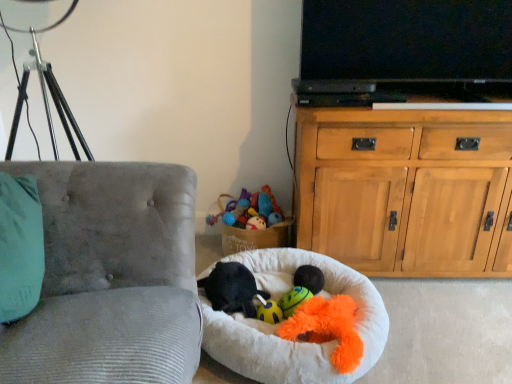
What is the approximate height of white fluffy dog bed at center?

It is 20.51 centimeters.

The width and height of the screenshot is (512, 384). Find the location of `white fluffy dog bed at center`. white fluffy dog bed at center is located at coordinates (276, 326).

Describe the element at coordinates (405, 190) in the screenshot. I see `wooden cabinet at right` at that location.

The image size is (512, 384). Find the location of `wooden cabinet at right`. wooden cabinet at right is located at coordinates (405, 190).

Locate an element on the screen. This screenshot has height=384, width=512. fluffy orange plush toy at center, which is counted as the second toy, starting from the back is located at coordinates (327, 328).

Describe the element at coordinates (110, 277) in the screenshot. Image resolution: width=512 pixels, height=384 pixels. I see `velvet gray chair at left` at that location.

The width and height of the screenshot is (512, 384). Describe the element at coordinates (293, 300) in the screenshot. I see `yellow rubber ball at center, positioned as the 2th toy in front-to-back order` at that location.

Locate an element on the screen. Image resolution: width=512 pixels, height=384 pixels. black plush dog bed at lower center, placed as the second animal when sorted from right to left is located at coordinates (232, 289).

From a real-world perspective, does fluffy orange plush toy at center, which is the first toy in front-to-back order, sit lower than velvet gray chair at left?

Yes.

Is fluffy orange plush toy at center, which is the first toy in front-to-back order, bigger than velvet gray chair at left?

Incorrect, fluffy orange plush toy at center, which is the first toy in front-to-back order, is not larger than velvet gray chair at left.

In the image, is fluffy orange plush toy at center, which is the first toy in front-to-back order, on the left side or the right side of velvet gray chair at left?

→ In the image, fluffy orange plush toy at center, which is the first toy in front-to-back order, appears on the right side of velvet gray chair at left.

Considering the positions of points (335, 333) and (33, 163), is point (335, 333) farther from camera compared to point (33, 163)?

Yes, point (335, 333) is behind point (33, 163).

Between point (223, 270) and point (311, 295), which one is positioned in front?

The point (311, 295) is closer to the camera.

Could yellow rubber ball at center, positioned as the 2th toy in front-to-back order, be considered to be inside black plush dog bed at lower center, which is the first animal in left-to-right order?

No, yellow rubber ball at center, positioned as the 2th toy in front-to-back order, is not surrounded by black plush dog bed at lower center, which is the first animal in left-to-right order.

Does black plush dog bed at lower center, placed as the second animal when sorted from right to left, have a lesser width compared to yellow rubber ball at center, which appears as the first toy when viewed from the back?

No.

From the image's perspective, which object appears higher, black plush dog bed at lower center, placed as the second animal when sorted from right to left, or yellow rubber ball at center, positioned as the 2th toy in front-to-back order?

black plush dog bed at lower center, placed as the second animal when sorted from right to left.

Does wooden cabinet at right have a greater height compared to black plush dog bed at lower center, which is the first animal in left-to-right order?

Correct, wooden cabinet at right is much taller as black plush dog bed at lower center, which is the first animal in left-to-right order.

From the image's perspective, is wooden cabinet at right below black plush dog bed at lower center, placed as the second animal when sorted from right to left?

Incorrect, from the image's perspective, wooden cabinet at right is higher than black plush dog bed at lower center, placed as the second animal when sorted from right to left.

Which object is further away from the camera taking this photo, yellow rubber ball at center, which appears as the first toy when viewed from the back, or wooden cabinet at right?

wooden cabinet at right is further away from the camera.

Is yellow rubber ball at center, positioned as the 2th toy in front-to-back order, positioned far away from wooden cabinet at right?

No.

Is yellow rubber ball at center, positioned as the 2th toy in front-to-back order, surrounding wooden cabinet at right?

No, wooden cabinet at right is not a part of yellow rubber ball at center, positioned as the 2th toy in front-to-back order.

From the picture: From the image's perspective, does yellow rubber ball at center, positioned as the 2th toy in front-to-back order, appear higher than wooden cabinet at right?

No, from the image's perspective, yellow rubber ball at center, positioned as the 2th toy in front-to-back order, is not on top of wooden cabinet at right.

Is black plush toy at center, which is counted as the 1th animal, starting from the right, inside velvet gray chair at left?

Actually, black plush toy at center, which is counted as the 1th animal, starting from the right, is outside velvet gray chair at left.

Based on their sizes in the image, would you say velvet gray chair at left is bigger or smaller than black plush toy at center, which is counted as the 1th animal, starting from the right?

velvet gray chair at left is bigger than black plush toy at center, which is counted as the 1th animal, starting from the right.

Is velvet gray chair at left facing away from black plush toy at center, which is counted as the 1th animal, starting from the right?

velvet gray chair at left does not have its back to black plush toy at center, which is counted as the 1th animal, starting from the right.

Is velvet gray chair at left outside of white fluffy dog bed at center?

Indeed, velvet gray chair at left is completely outside white fluffy dog bed at center.

Which is behind, velvet gray chair at left or white fluffy dog bed at center?

white fluffy dog bed at center is further from the camera.

Considering the relative sizes of velvet gray chair at left and white fluffy dog bed at center in the image provided, is velvet gray chair at left smaller than white fluffy dog bed at center?

No.

Between velvet gray chair at left and white fluffy dog bed at center, which one has larger width?

Wider between the two is white fluffy dog bed at center.

Between white fluffy dog bed at center and fluffy orange plush toy at center, which is counted as the second toy, starting from the back, which one has larger width?

white fluffy dog bed at center.

Which is in front, point (336, 275) or point (305, 302)?

The point (305, 302) is closer to the camera.

Measure the distance between white fluffy dog bed at center and fluffy orange plush toy at center, which is the first toy in front-to-back order.

white fluffy dog bed at center is 4.61 inches from fluffy orange plush toy at center, which is the first toy in front-to-back order.

Is white fluffy dog bed at center further to the viewer compared to fluffy orange plush toy at center, which is counted as the second toy, starting from the back?

No.

Locate an element on the screen. chair above the fluffy orange plush toy at center, which is the first toy in front-to-back order (from a real-world perspective) is located at coordinates (110, 277).

The image size is (512, 384). What are the coordinates of `the 1st toy below when counting from the black plush dog bed at lower center, which is the first animal in left-to-right order (from the image's perspective)` in the screenshot? It's located at (293, 300).

Estimate the real-world distances between objects in this image. Which object is closer to fluffy orange plush toy at center, which is counted as the second toy, starting from the back, wooden cabinet at right or black plush dog bed at lower center, which is the first animal in left-to-right order?

black plush dog bed at lower center, which is the first animal in left-to-right order, is closer to fluffy orange plush toy at center, which is counted as the second toy, starting from the back.

Based on the photo, when comparing their distances from velvet gray chair at left, does wooden cabinet at right or white fluffy dog bed at center seem closer?

white fluffy dog bed at center is closer to velvet gray chair at left.

From the image, which object appears to be nearer to black plush toy at center, which is counted as the 1th animal, starting from the right, white fluffy dog bed at center or fluffy orange plush toy at center, which is the first toy in front-to-back order?

Among the two, white fluffy dog bed at center is located nearer to black plush toy at center, which is counted as the 1th animal, starting from the right.

Which object lies nearer to the anchor point yellow rubber ball at center, which appears as the first toy when viewed from the back, white fluffy dog bed at center or velvet gray chair at left?

Among the two, white fluffy dog bed at center is located nearer to yellow rubber ball at center, which appears as the first toy when viewed from the back.

When comparing their distances from black plush dog bed at lower center, which is the first animal in left-to-right order, does velvet gray chair at left or wooden cabinet at right seem closer?

Based on the image, velvet gray chair at left appears to be nearer to black plush dog bed at lower center, which is the first animal in left-to-right order.

Based on their spatial positions, is fluffy orange plush toy at center, which is counted as the second toy, starting from the back, or black plush toy at center, which is counted as the 1th animal, starting from the right, closer to velvet gray chair at left?

Based on the image, fluffy orange plush toy at center, which is counted as the second toy, starting from the back, appears to be nearer to velvet gray chair at left.

When comparing their distances from black plush dog bed at lower center, which is the first animal in left-to-right order, does yellow rubber ball at center, which appears as the first toy when viewed from the back, or white fluffy dog bed at center seem further?

Among the two, yellow rubber ball at center, which appears as the first toy when viewed from the back, is located further to black plush dog bed at lower center, which is the first animal in left-to-right order.

Based on their spatial positions, is fluffy orange plush toy at center, which is counted as the second toy, starting from the back, or black plush toy at center, placed as the 2th animal when sorted from left to right, further from white fluffy dog bed at center?

Based on the image, black plush toy at center, placed as the 2th animal when sorted from left to right, appears to be further to white fluffy dog bed at center.

Find the location of a particular element. animal between white fluffy dog bed at center and wooden cabinet at right is located at coordinates (309, 278).

The width and height of the screenshot is (512, 384). Find the location of `animal between velvet gray chair at left and black plush toy at center, placed as the 2th animal when sorted from left to right`. animal between velvet gray chair at left and black plush toy at center, placed as the 2th animal when sorted from left to right is located at coordinates (232, 289).

Find the location of a particular element. This screenshot has width=512, height=384. toy situated between yellow rubber ball at center, positioned as the 2th toy in front-to-back order, and wooden cabinet at right from left to right is located at coordinates (327, 328).

This screenshot has height=384, width=512. In order to click on dog bed between velvet gray chair at left and wooden cabinet at right from left to right in this screenshot , I will do `click(276, 326)`.